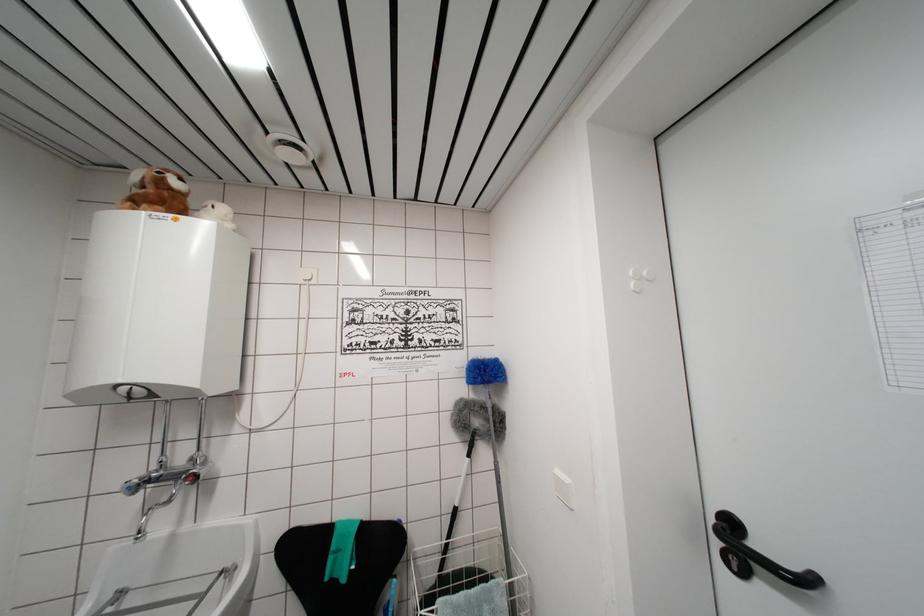
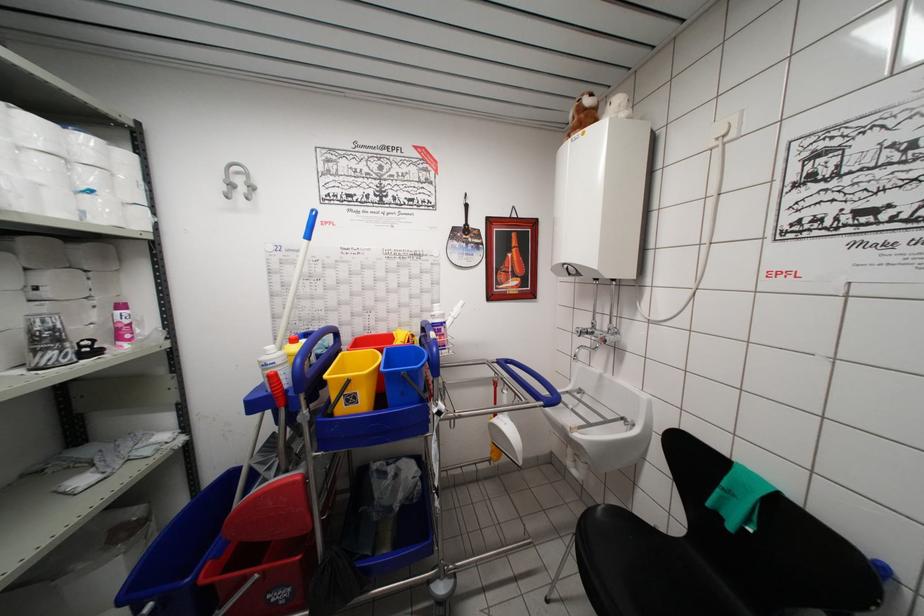
Question: The images are taken continuously from a first-person perspective. In which direction is your viewpoint rotating?

Choices:
 (A) Left
 (B) Right
 (C) Up
 (D) Down

Answer: (A)